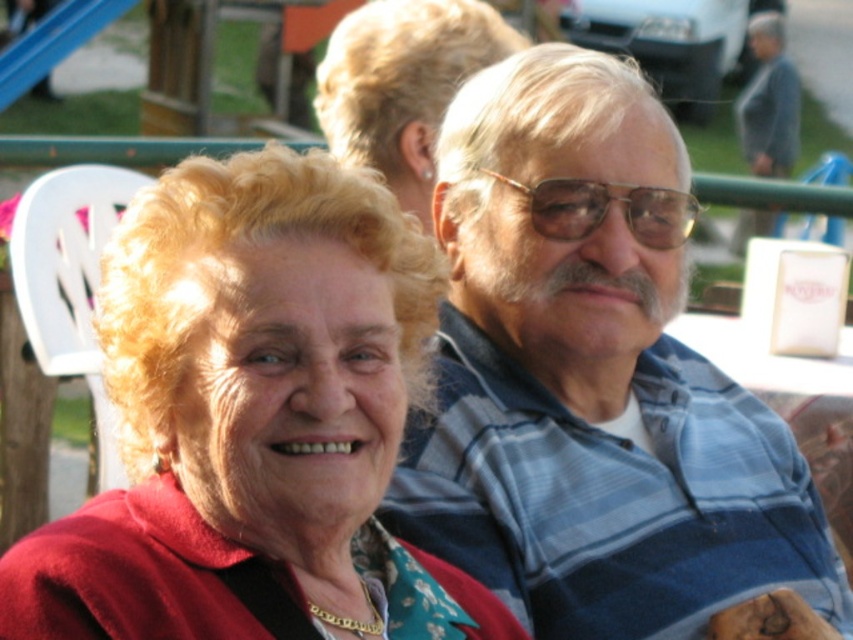
Question: Which point is farther to the camera?

Choices:
 (A) (500, 556)
 (B) (320, 500)

Answer: (A)

Question: Does matte red sweater at center have a lesser width compared to blonde hair at upper center?

Choices:
 (A) yes
 (B) no

Answer: (B)

Question: Based on their relative distances, which object is farther from the blue striped shirt at upper right?

Choices:
 (A) matte red sweater at center
 (B) blonde hair at upper center

Answer: (B)

Question: Does blue striped shirt at upper right appear on the left side of blonde hair at upper center?

Choices:
 (A) no
 (B) yes

Answer: (A)

Question: Is matte red sweater at center thinner than blonde hair at upper center?

Choices:
 (A) no
 (B) yes

Answer: (A)

Question: Which point appears closest to the camera in this image?

Choices:
 (A) (410, 36)
 (B) (193, 284)

Answer: (B)